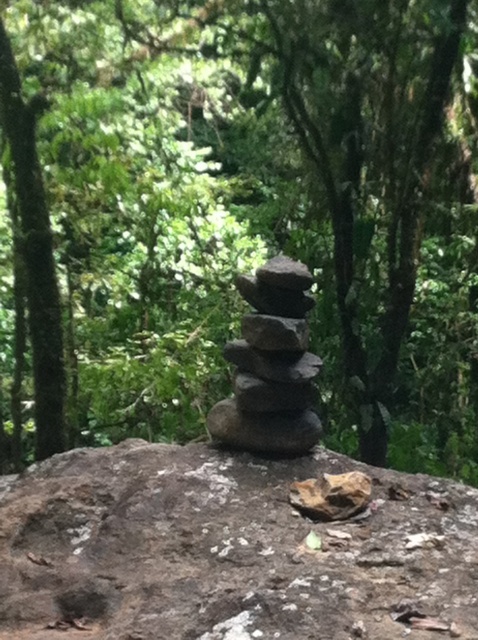
You are standing at the base of the stack of stones in the image. Looking towards the green leafy tree marked by point (260, 204), which direction should you face to see it?

The point (260, 204) marks the green leafy tree at center, so you should face towards the center to see it.

You are a hiker who wants to place a 1.5 meter long tent between the green leafy tree at center and the brown rough rock at center. Can you fit the tent there?

The distance between the green leafy tree at center and the brown rough rock at center is 1.62 meters. Since the tent is 1.5 meters long, it can fit between them with 0.12 meters of space remaining.